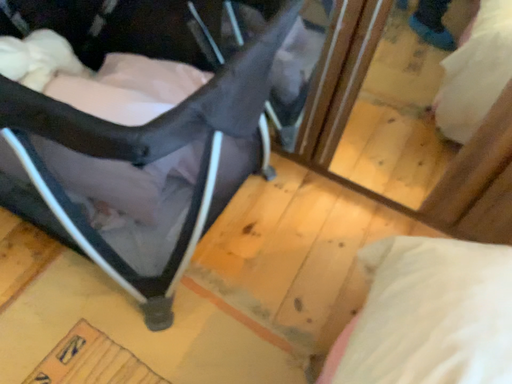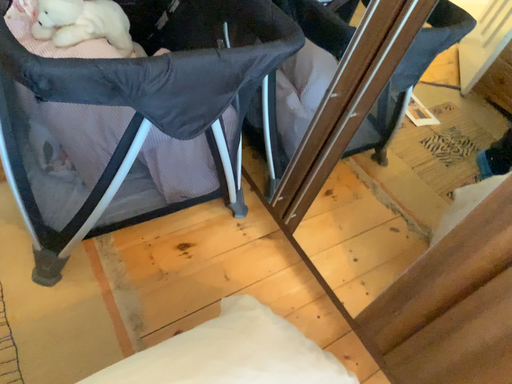
Question: How did the camera likely rotate when shooting the video?

Choices:
 (A) rotated left
 (B) rotated right

Answer: (A)